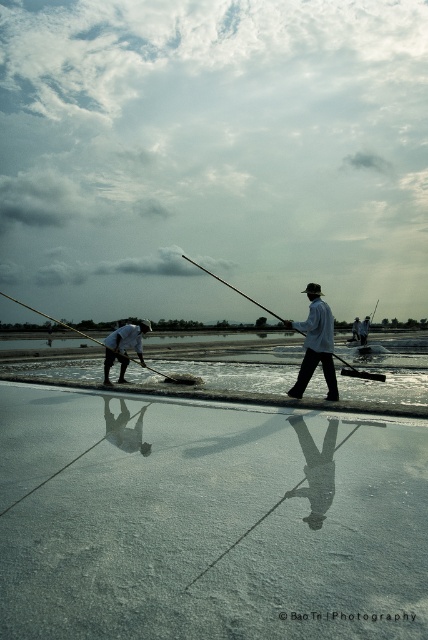
Which of these two, wooden fishing pole at center or wooden pole at left, stands shorter?

wooden pole at left

Find the location of `wooden fishing pole at center`. wooden fishing pole at center is located at coordinates (234, 289).

Does light blue fabric fisherman at center appear on the left side of wooden pole at left?

In fact, light blue fabric fisherman at center is to the right of wooden pole at left.

Does light blue fabric fisherman at center have a lesser height compared to wooden pole at left?

Indeed, light blue fabric fisherman at center has a lesser height compared to wooden pole at left.

Consider the image. Who is more forward, (x=311, y=289) or (x=166, y=376)?

Positioned in front is point (x=311, y=289).

You are a GUI agent. You are given a task and a screenshot of the screen. Output one action in this format:
    pyautogui.click(x=<x>, y=<y>)
    Task: Click on the light blue fabric fisherman at center
    
    Given the screenshot: What is the action you would take?
    pyautogui.click(x=315, y=342)

Can you confirm if light blue fabric fisherman at center is shorter than wooden fishing pole at center?

Correct, light blue fabric fisherman at center is not as tall as wooden fishing pole at center.

What are the coordinates of `light blue fabric fisherman at center` in the screenshot? It's located at (315, 342).